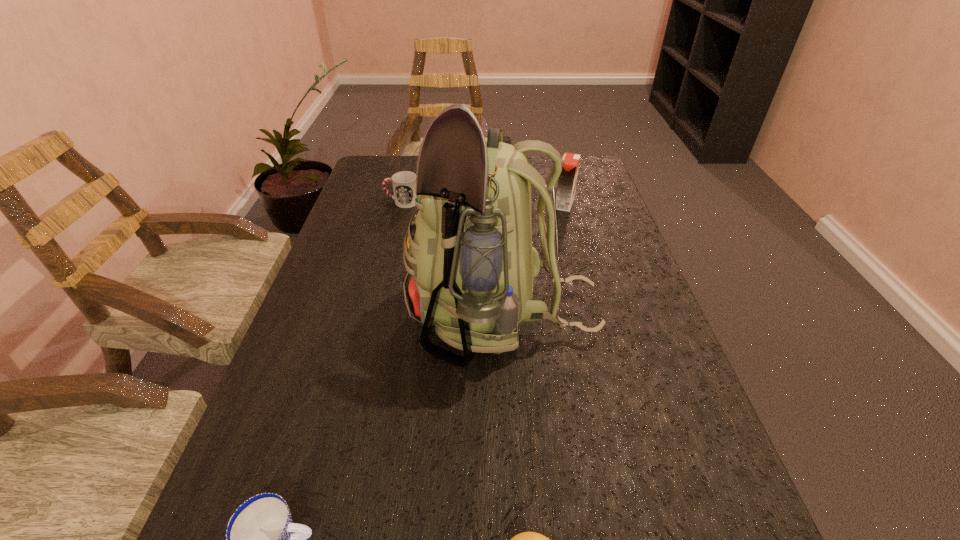
At what (x,y) coordinates should I click in order to perform the action: click on vacant space at the right edge of the desktop. Please return your answer as a coordinate pair (x, y). The image size is (960, 540). Looking at the image, I should click on (569, 233).

Where is `free point at the far left corner`? free point at the far left corner is located at coordinates (369, 167).

Identify which object is located as the fourth nearest to the shorter cup. Please provide its 2D coordinates. Your answer should be formatted as a tuple, i.e. [(x, y)], where the tuple contains the x and y coordinates of a point satisfying the conditions above.

[(566, 185)]

Identify which object is the nearest to the shortest object. Please provide its 2D coordinates. Your answer should be formatted as a tuple, i.e. [(x, y)], where the tuple contains the x and y coordinates of a point satisfying the conditions above.

[(472, 265)]